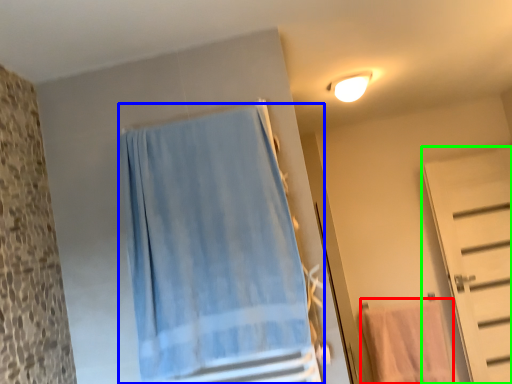
Question: Which object is positioned farthest from beach towel (highlighted by a red box)? Select from curtain (highlighted by a blue box) and door (highlighted by a green box).

Choices:
 (A) curtain
 (B) door

Answer: (A)